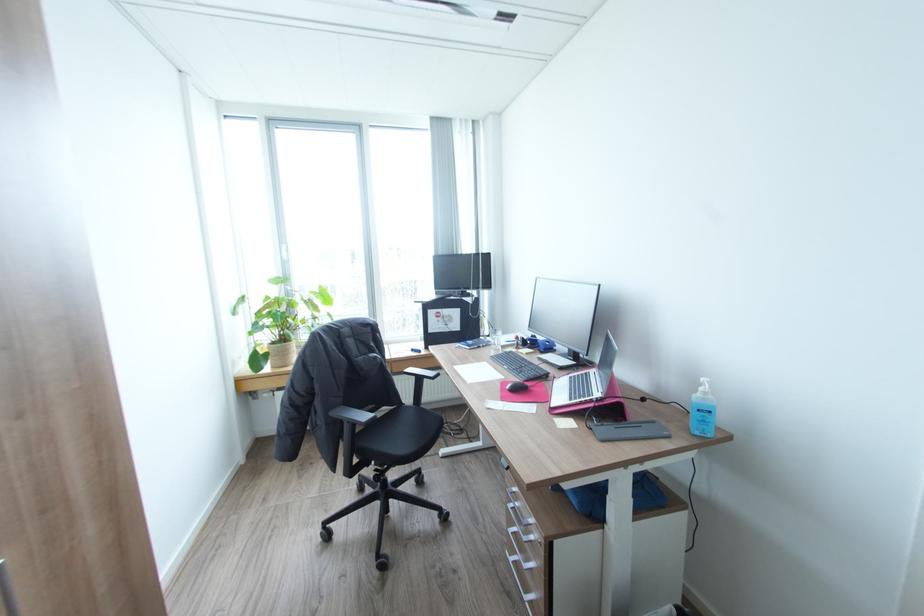
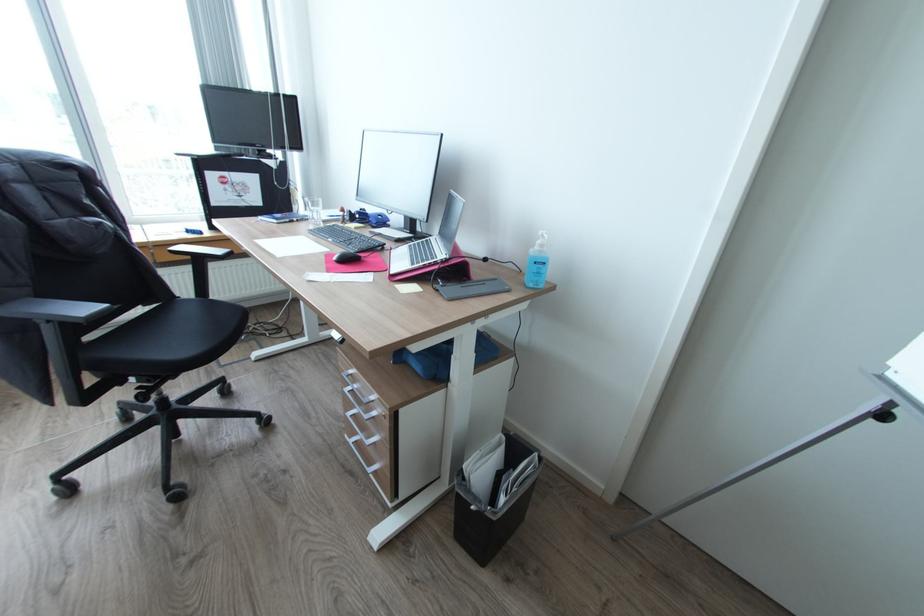
In the second image, find the point that corresponds to (x=701, y=432) in the first image.

(536, 284)